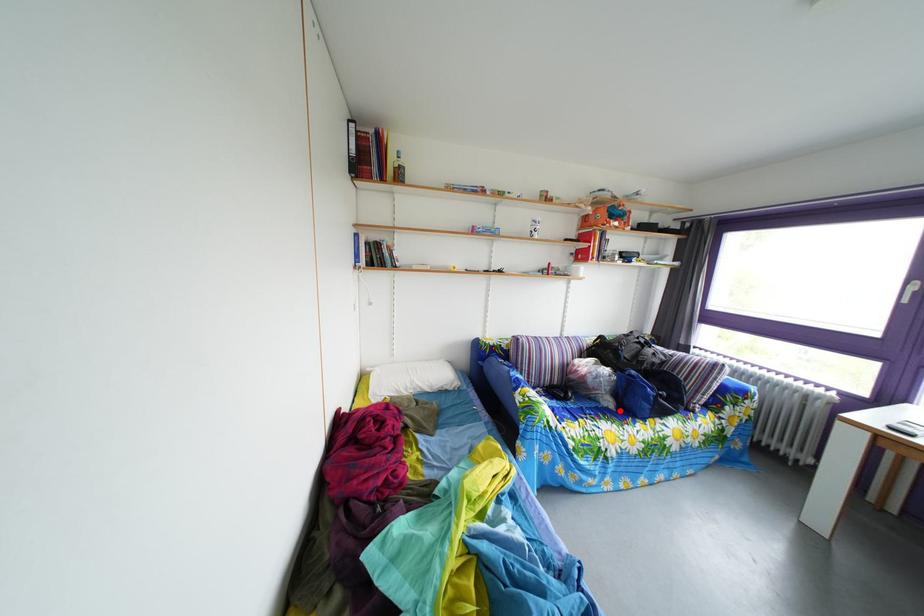
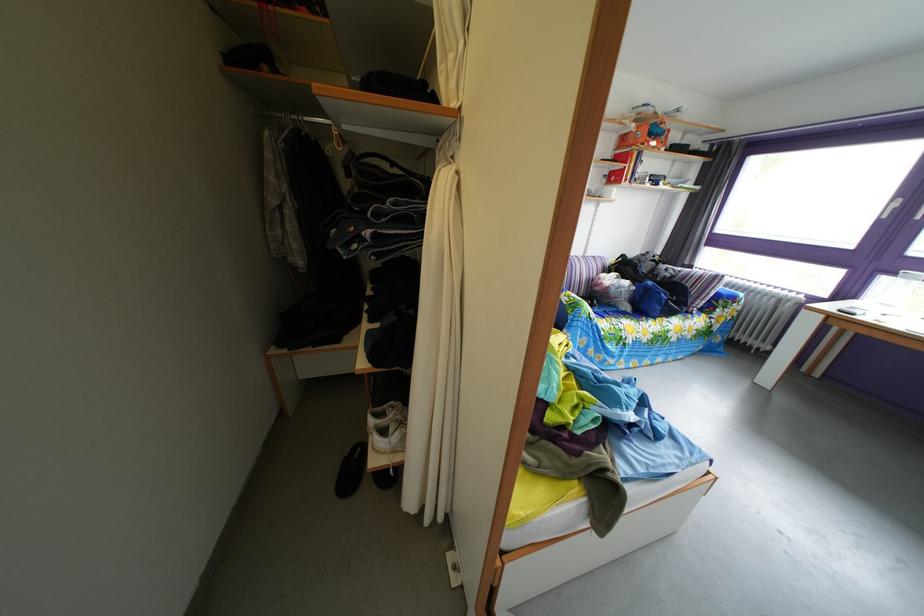
Question: I am providing you with two images of the same scene from different viewpoints. Image1 has a red point marked. In image2, the corresponding 3D location appears at what relative position? Reply with the corresponding letter.

Choices:
 (A) Closer
 (B) Farther

Answer: (A)